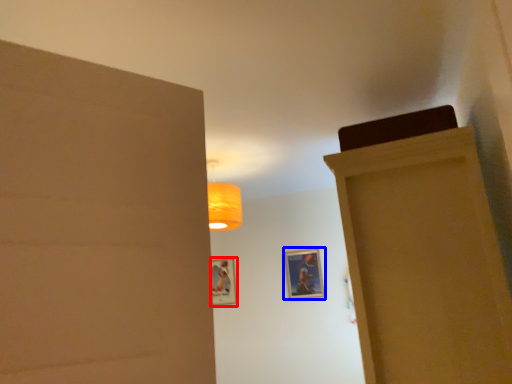
Question: Which object is further to the camera taking this photo, picture frame (highlighted by a red box) or picture frame (highlighted by a blue box)?

Choices:
 (A) picture frame
 (B) picture frame

Answer: (A)